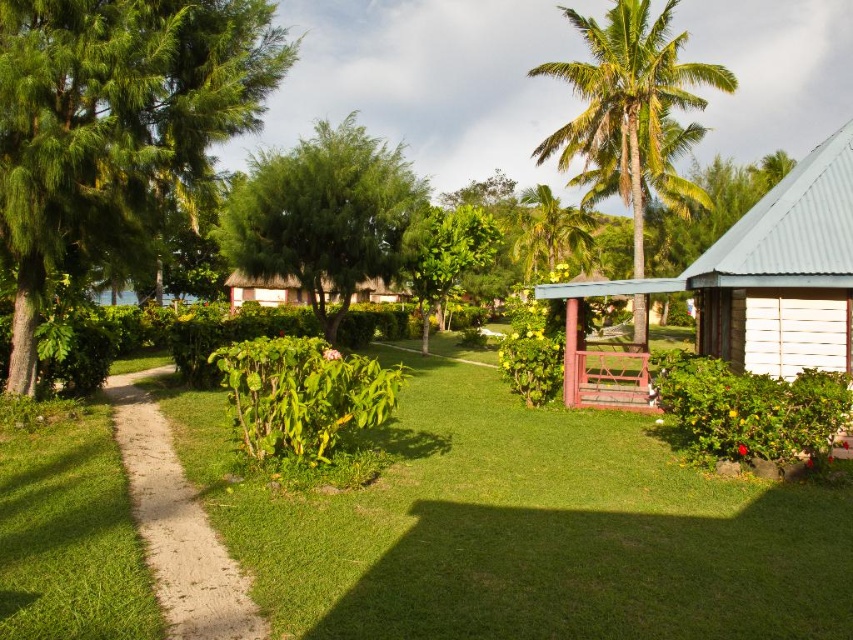
Question: Which point is farther from the camera taking this photo?

Choices:
 (A) (357, 129)
 (B) (648, 180)
 (C) (721, 284)
 (D) (149, 508)

Answer: (B)

Question: Can you confirm if green leafy tree at left is thinner than white corrugated metal hut at right?

Choices:
 (A) yes
 (B) no

Answer: (A)

Question: Can you confirm if green leafy tree at left is positioned to the left of white corrugated metal hut at right?

Choices:
 (A) no
 (B) yes

Answer: (B)

Question: Which of these objects is positioned farthest from the white corrugated metal hut at right?

Choices:
 (A) green leafy palm tree at upper right
 (B) green leafy tree at left
 (C) dirt/gravel path at center

Answer: (C)

Question: Is green leafy tree at left to the left of green leafy palm tree at upper right from the viewer's perspective?

Choices:
 (A) no
 (B) yes

Answer: (B)

Question: Which of the following is the closest to the observer?

Choices:
 (A) (178, 54)
 (B) (225, 570)

Answer: (B)